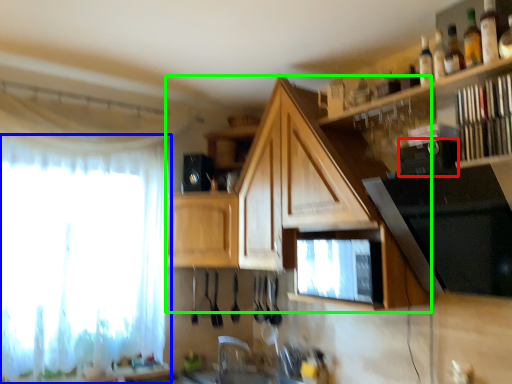
Question: Estimate the real-world distances between objects in this image. Which object is farther from appliance (highlighted by a red box), curtain (highlighted by a blue box) or cabinetry (highlighted by a green box)?

Choices:
 (A) curtain
 (B) cabinetry

Answer: (A)